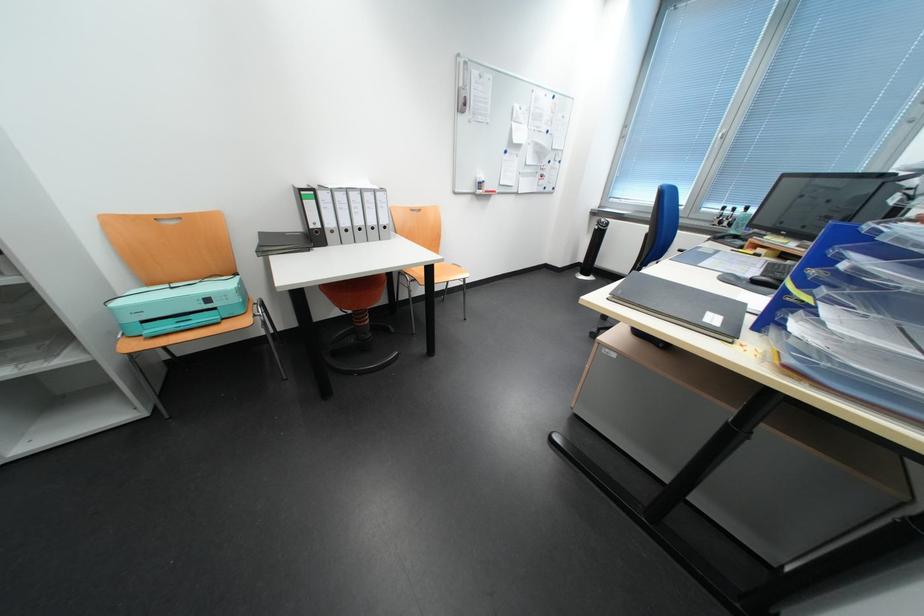
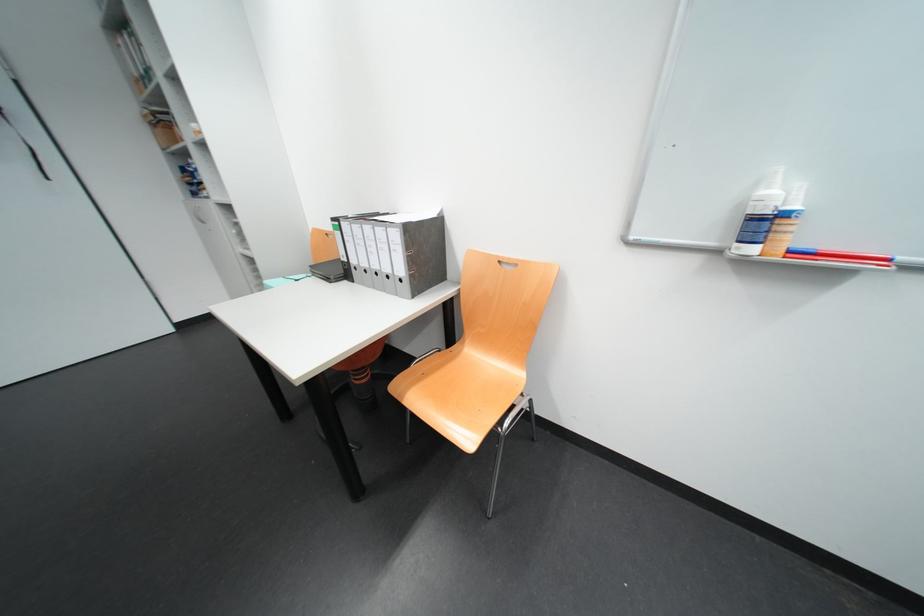
In the second image, find the point that corresponds to (x=489, y=177) in the first image.

(773, 193)